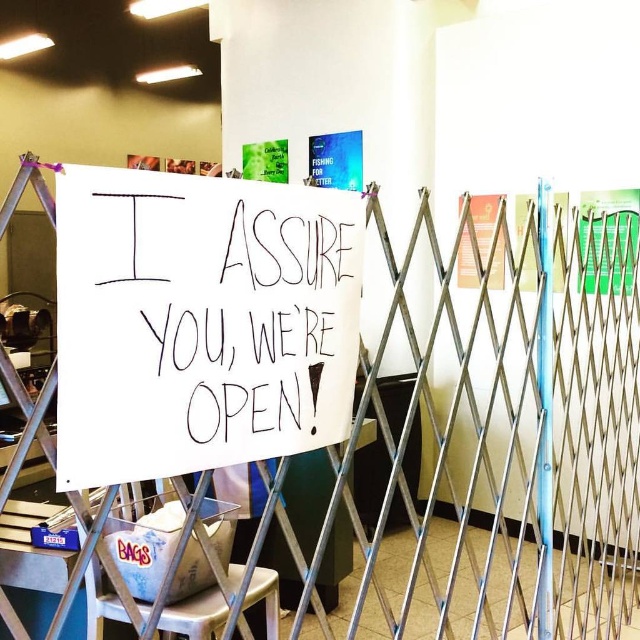
You are a customer standing at the entrance of the store. You see a small blue box labeled BAGS and a point at coordinate [218,448]. Can you reach the small blue box labeled BAGS from your current position without crossing the metal folding gate?

The small blue box labeled BAGS and the point at coordinate [218,448] are 35.48 inches apart. Since the metal folding gate is partially open, you can reach the small blue box labeled BAGS without crossing the gate if the distance between you and the box is within your reach. However, the exact reachability depends on your arm length and the gate obstruction. The question does not provide enough information to confirm this definitively.

You are a customer entering the store through the open metal gate. You see the white paper sign at center and the white plastic stool at lower left. Which object is closer to you as you enter?

The white paper sign at center is closer to you because it is in front of the white plastic stool at lower left.

You are a customer entering the store and see the white paper sign at center and the metallic silver pole at right. Which object is shorter?

The white paper sign at center is shorter than the metallic silver pole at right.